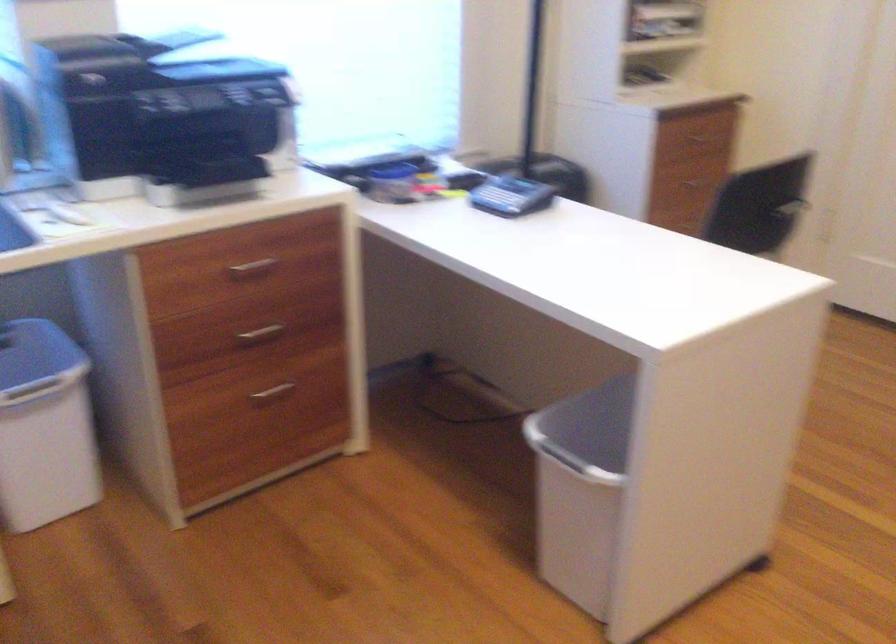
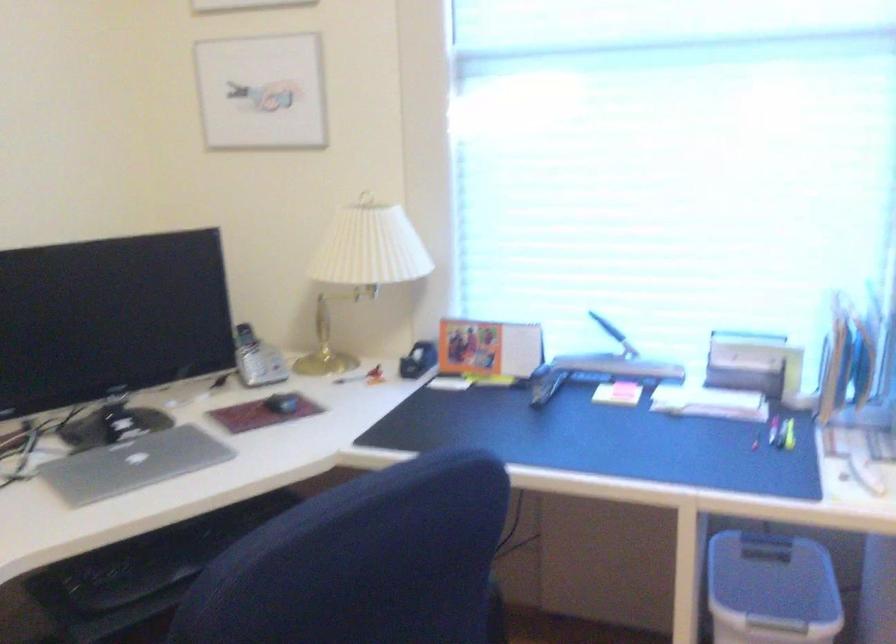
Question: How did the camera likely rotate?

Choices:
 (A) Left
 (B) Right
 (C) Up
 (D) Down

Answer: (A)